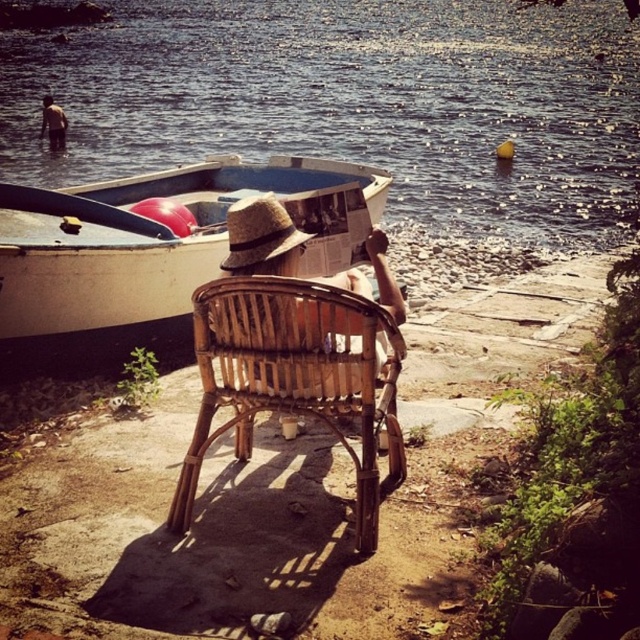
Between white matte boat at center and brown leather jacket at upper left, which one appears on the right side from the viewer's perspective?

Positioned to the right is white matte boat at center.

Can you confirm if white matte boat at center is smaller than brown leather jacket at upper left?

Yes.

At what (x,y) coordinates should I click in order to perform the action: click on white matte boat at center. Please return your answer as a coordinate pair (x, y). Looking at the image, I should click on (161, 237).

Find the location of a particular element. Image resolution: width=640 pixels, height=640 pixels. white matte boat at center is located at coordinates (161, 237).

Is point (240, 140) more distant than point (365, 401)?

Yes, it is.

Is point (225, 45) farther from viewer compared to point (284, 371)?

Yes.

Locate an element on the screen. The image size is (640, 640). blue water at center is located at coordinates (353, 100).

Who is shorter, blue water at center or white matte boat at center?

Standing shorter between the two is white matte boat at center.

Who is higher up, blue water at center or white matte boat at center?

blue water at center

Between point (252, 122) and point (145, 296), which one is positioned in front?

Point (145, 296) is more forward.

Where is `blue water at center`? blue water at center is located at coordinates (353, 100).